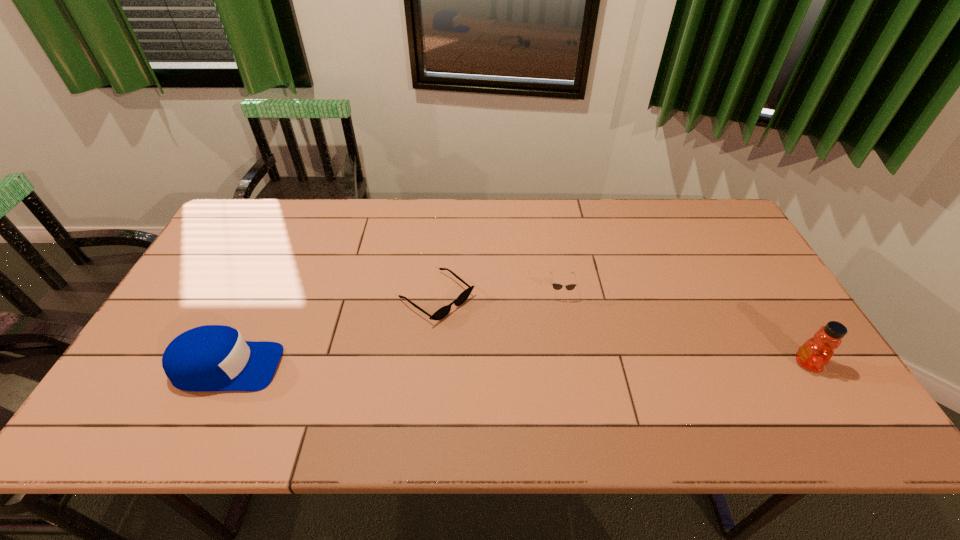
In order to click on empty space that is in between the rightmost object and the right sunglasses in this screenshot , I will do tap(684, 328).

What are the coordinates of `vacant space that is in between the right sunglasses and the third object from right to left` in the screenshot? It's located at (498, 295).

This screenshot has height=540, width=960. In order to click on empty space that is in between the shorter sunglasses and the right sunglasses in this screenshot , I will do `click(498, 295)`.

Where is `free point between the second shortest object and the shortest object`? free point between the second shortest object and the shortest object is located at coordinates pos(498,295).

Identify the location of free space between the taller sunglasses and the baseball cap. This screenshot has height=540, width=960. (394, 330).

At what (x,y) coordinates should I click in order to perform the action: click on free spot between the honey and the left sunglasses. Please return your answer as a coordinate pair (x, y). This screenshot has height=540, width=960. Looking at the image, I should click on (622, 331).

Locate which object is the third closest to the rightmost object. Please provide its 2D coordinates. Your answer should be formatted as a tuple, i.e. [(x, y)], where the tuple contains the x and y coordinates of a point satisfying the conditions above.

[(207, 358)]

Locate which object is the third closest to the right sunglasses. Please provide its 2D coordinates. Your answer should be formatted as a tuple, i.e. [(x, y)], where the tuple contains the x and y coordinates of a point satisfying the conditions above.

[(207, 358)]

Locate an element on the screen. blank space that satisfies the following two spatial constraints: 1. on the back side of the third object from left to right; 2. on the left side of the second object from left to right is located at coordinates (438, 292).

Locate an element on the screen. This screenshot has width=960, height=540. free spot that satisfies the following two spatial constraints: 1. on the front side of the tallest object; 2. on the front label of the third object from left to right is located at coordinates 572,364.